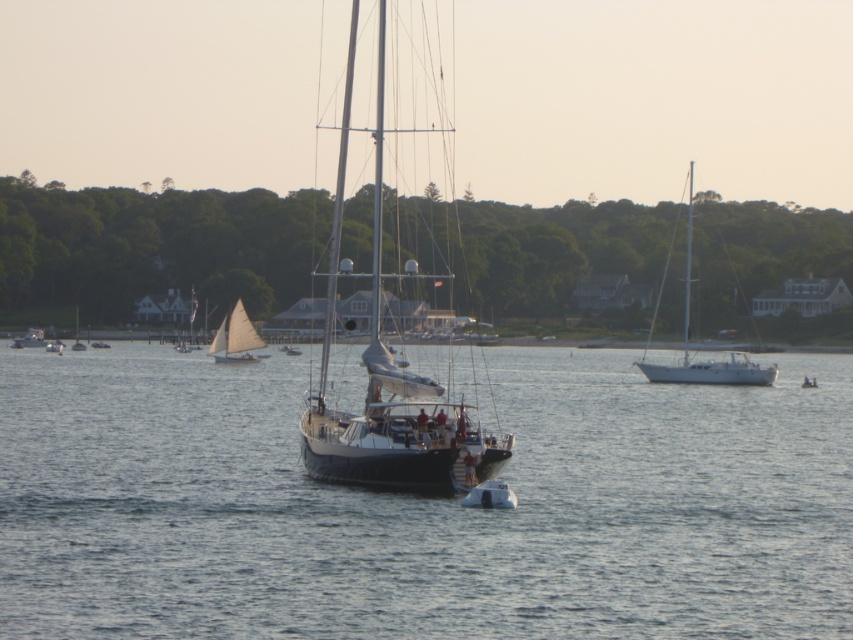
Question: Can you confirm if smooth water at center is thinner than black matte sailboat at center?

Choices:
 (A) yes
 (B) no

Answer: (B)

Question: Among these points, which one is nearest to the camera?

Choices:
 (A) (688, 289)
 (B) (468, 492)
 (C) (78, 344)
 (D) (341, 268)

Answer: (B)

Question: Which point appears closest to the camera in this image?

Choices:
 (A) (76, 340)
 (B) (224, 346)

Answer: (B)

Question: Which object is farther from the camera taking this photo?

Choices:
 (A) white sailboat at upper left
 (B) shiny white sailboat at center
 (C) matte black sailboat at center

Answer: (B)

Question: Does black matte sailboat at center have a greater width compared to white glossy dinghy at center?

Choices:
 (A) yes
 (B) no

Answer: (A)

Question: Observing the image, what is the correct spatial positioning of white glossy sailboat at right in reference to matte black sailboat at center?

Choices:
 (A) below
 (B) above

Answer: (B)